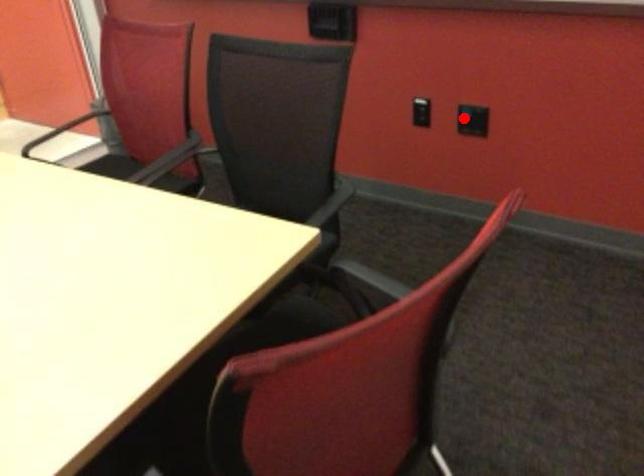
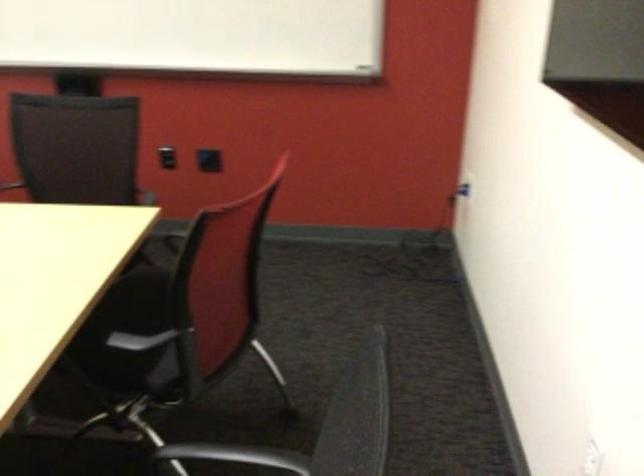
The point at the highlighted location is marked in the first image. Where is the corresponding point in the second image?

(207, 160)